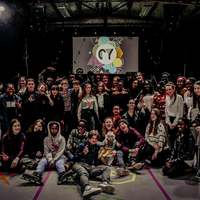
Image resolution: width=200 pixels, height=200 pixels. In order to click on ceiling in this screenshot , I will do `click(104, 5)`.